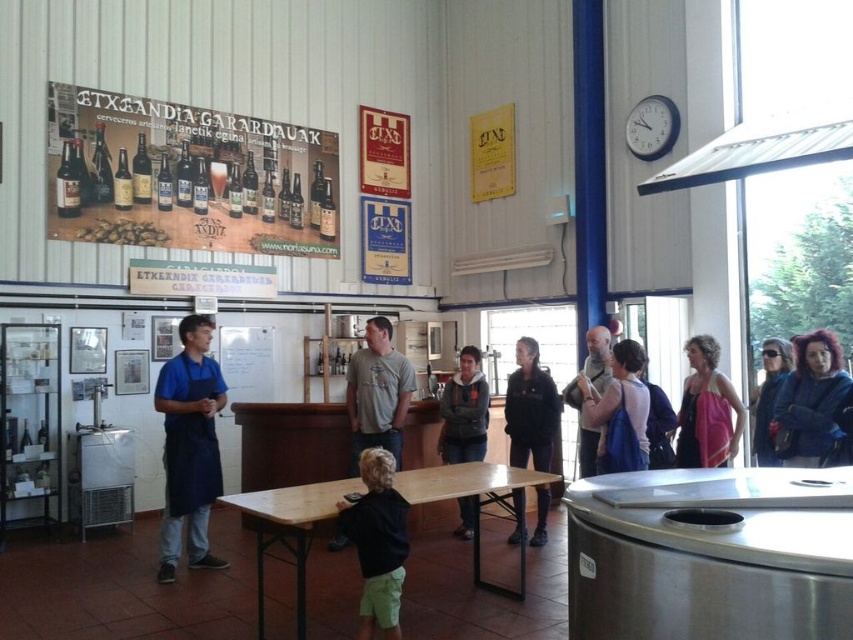
This screenshot has width=853, height=640. What do you see at coordinates (619, 408) in the screenshot? I see `matte blue dress at center` at bounding box center [619, 408].

Which of these two, matte blue dress at center or white plastic clock at upper right, stands shorter?

With less height is white plastic clock at upper right.

Is point (616, 388) less distant than point (656, 129)?

Yes, it is.

Find the location of a particular element. This screenshot has height=640, width=853. matte blue dress at center is located at coordinates (619, 408).

Can you confirm if matte paper poster at upper left is taller than light brown wooden table at center?

Indeed, matte paper poster at upper left has a greater height compared to light brown wooden table at center.

Between point (135, 224) and point (491, 497), which one is positioned in front?

Point (491, 497)

Is point (102, 90) positioned before point (291, 512)?

That is False.

Locate an element on the screen. matte paper poster at upper left is located at coordinates (187, 177).

Is matte paper poster at upper left thinner than matte blue dress at center?

No, matte paper poster at upper left is not thinner than matte blue dress at center.

How distant is matte paper poster at upper left from matte blue dress at center?

A distance of 14.39 feet exists between matte paper poster at upper left and matte blue dress at center.

Who is more distant from viewer, [100,216] or [624,369]?

Positioned behind is point [100,216].

At what (x,y) coordinates should I click in order to perform the action: click on matte paper poster at upper left. Please return your answer as a coordinate pair (x, y). Looking at the image, I should click on (187, 177).